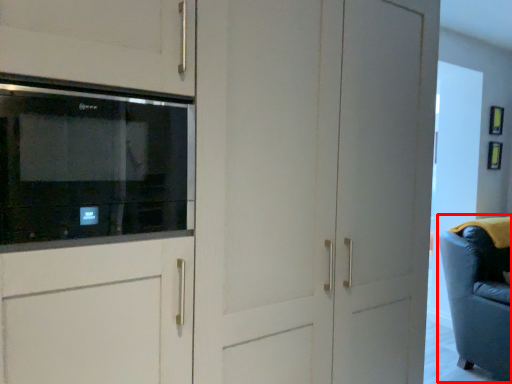
Question: From the image's perspective, where is swivel chair (annotated by the red box) located in relation to microwave oven in the image?

Choices:
 (A) below
 (B) above

Answer: (A)